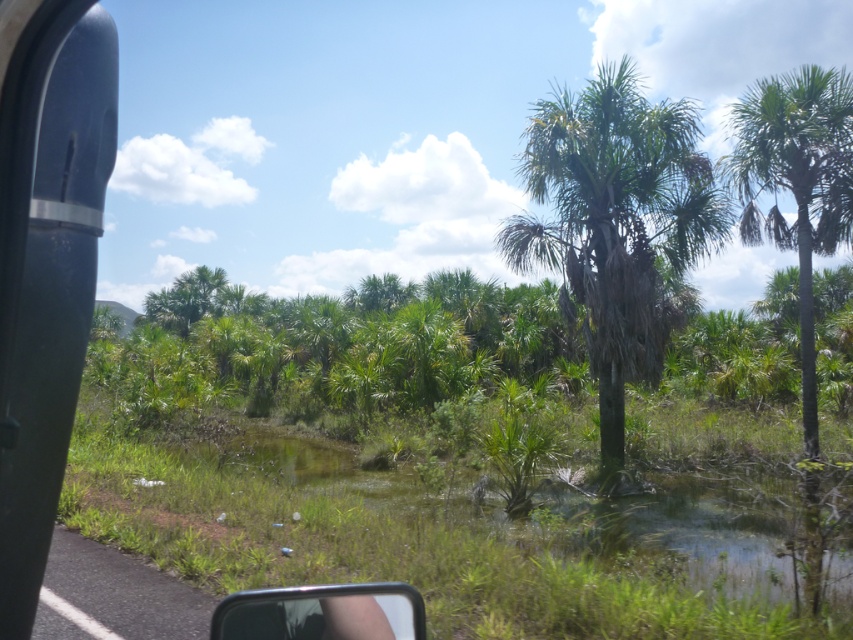
You are a passenger in a car and see the green leafy palm tree at center and the clear plastic view mirror at lower center. Which object is closer to you?

The clear plastic view mirror at lower center is behind the green leafy palm tree at center, so the green leafy palm tree at center is closer to you.